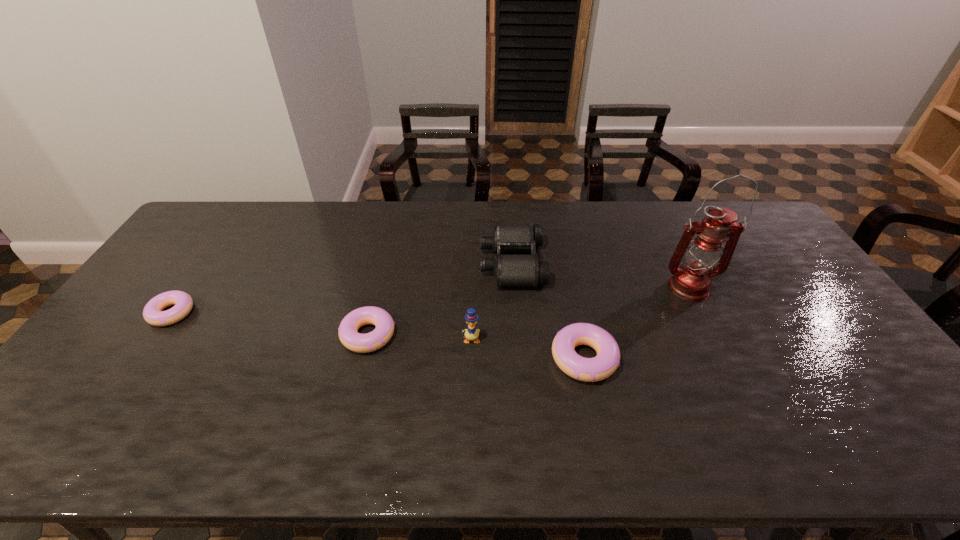
Please point out where to position a new doughnut on the right to maintain spacing. Please provide its 2D coordinates. Your answer should be formatted as a tuple, i.e. [(x, y)], where the tuple contains the x and y coordinates of a point satisfying the conditions above.

[(823, 384)]